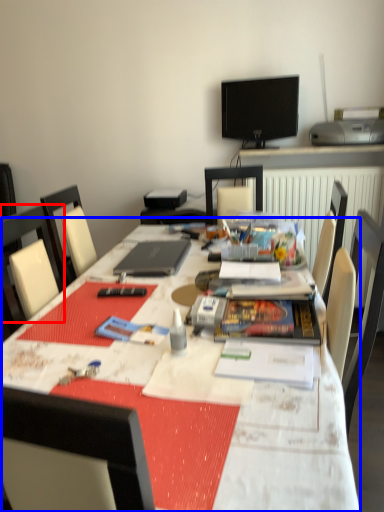
Question: Which of the following is the farthest to the observer, chair (highlighted by a red box) or table (highlighted by a blue box)?

Choices:
 (A) chair
 (B) table

Answer: (A)